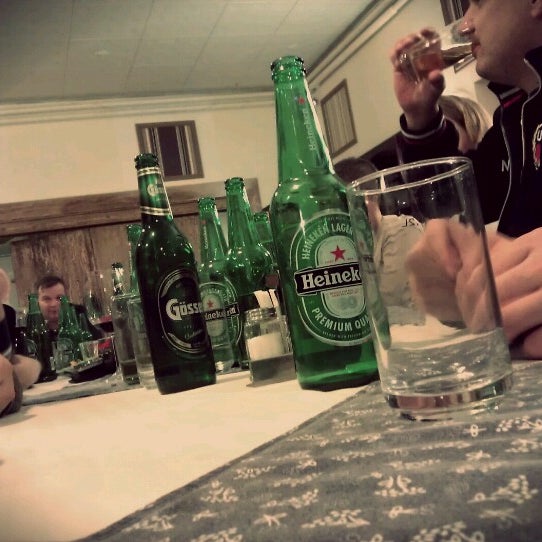
Where is `window`? This screenshot has width=542, height=542. window is located at coordinates (186, 156), (333, 120), (454, 11).